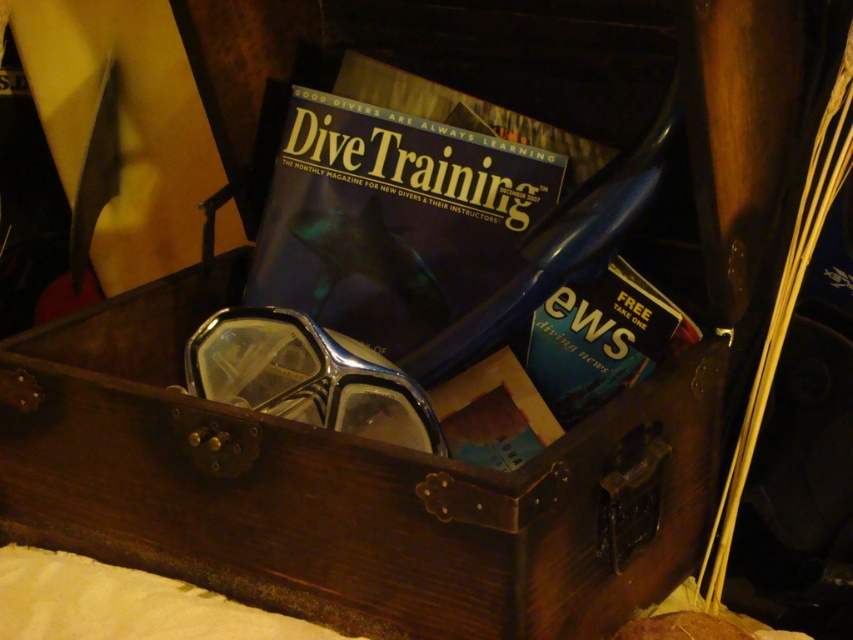
The image size is (853, 640). What do you see at coordinates (392, 220) in the screenshot?
I see `blue glossy magazine at center` at bounding box center [392, 220].

Is point (335, 234) positioned after point (263, 378)?

That is True.

Where is `blue glossy magazine at center`? blue glossy magazine at center is located at coordinates (392, 220).

Can you confirm if blue glossy magazine at center is wider than blue paper at center?

Yes.

Is point (381, 212) behind point (537, 358)?

Yes, it is.

Where is `blue glossy magazine at center`? This screenshot has width=853, height=640. blue glossy magazine at center is located at coordinates (392, 220).

Which is behind, point (625, 330) or point (474, 124)?

Point (474, 124)

Does blue paper at center have a larger size compared to blue matte magazine at upper center?

Incorrect, blue paper at center is not larger than blue matte magazine at upper center.

I want to click on blue paper at center, so click(601, 339).